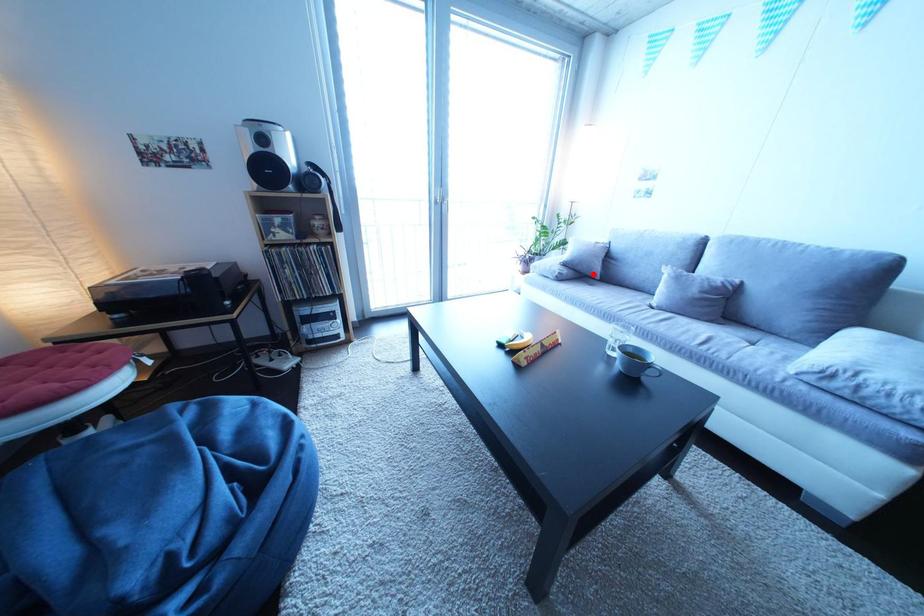
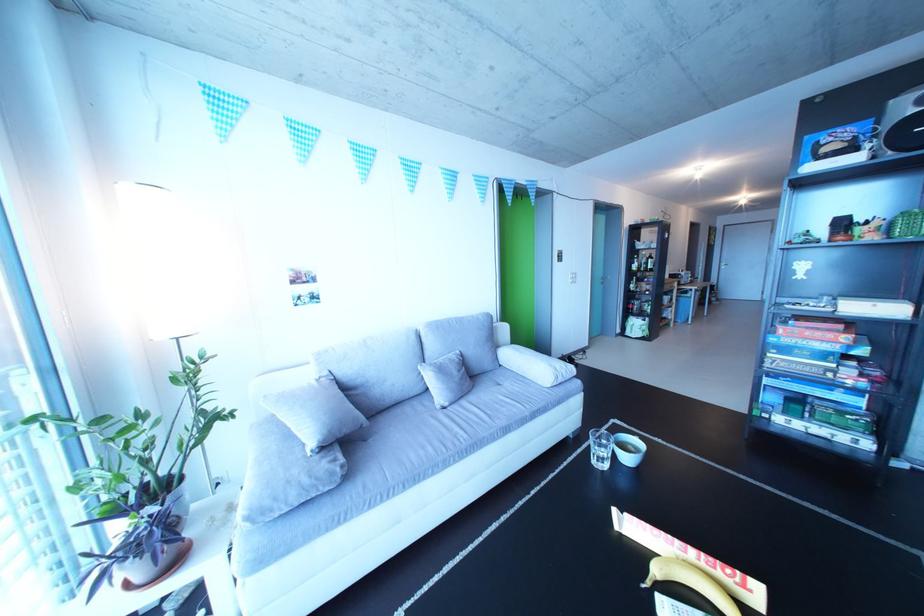
Where in the second image is the point corresponding to the highlighted location from the first image?

(359, 437)